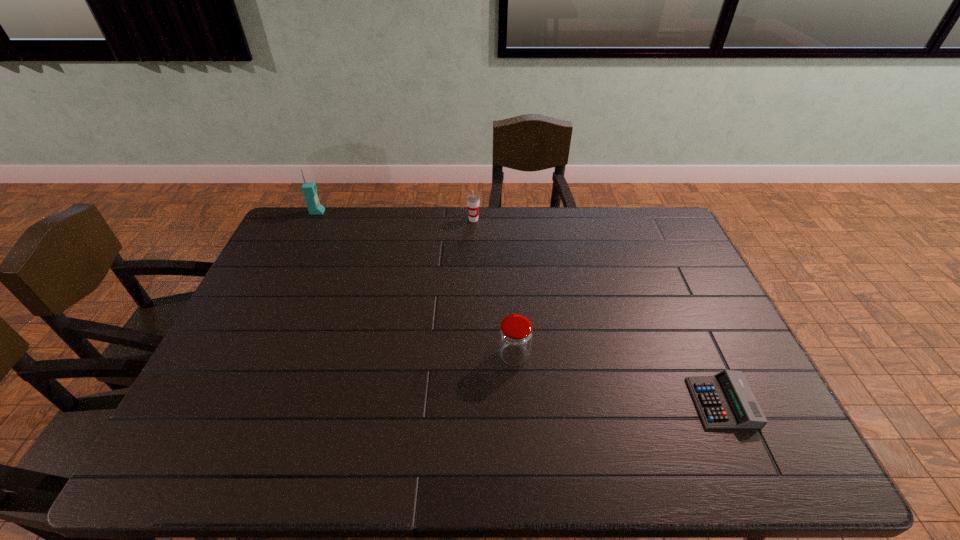
You are a GUI agent. You are given a task and a screenshot of the screen. Output one action in this format:
    pyautogui.click(x=<x>, y=<y>)
    Task: Click on the vacant position in the image that satisfies the following two spatial constraints: 1. on the keypad of the third object from left to right; 2. on the right side of the farthest object
    
    Given the screenshot: What is the action you would take?
    pyautogui.click(x=251, y=356)

You are a GUI agent. You are given a task and a screenshot of the screen. Output one action in this format:
    pyautogui.click(x=<x>, y=<y>)
    Task: Click on the vacant space that satisfies the following two spatial constraints: 1. on the keypad of the tallest object; 2. on the right side of the calculator
    
    Given the screenshot: What is the action you would take?
    pyautogui.click(x=228, y=402)

The width and height of the screenshot is (960, 540). In order to click on free location that satisfies the following two spatial constraints: 1. on the keypad of the calculator; 2. on the left side of the farthest object in this screenshot , I will do `click(228, 402)`.

Image resolution: width=960 pixels, height=540 pixels. In order to click on vacant region that satisfies the following two spatial constraints: 1. on the side of the second object from left to right with the logo; 2. on the left side of the shortest object in this screenshot , I will do `click(470, 402)`.